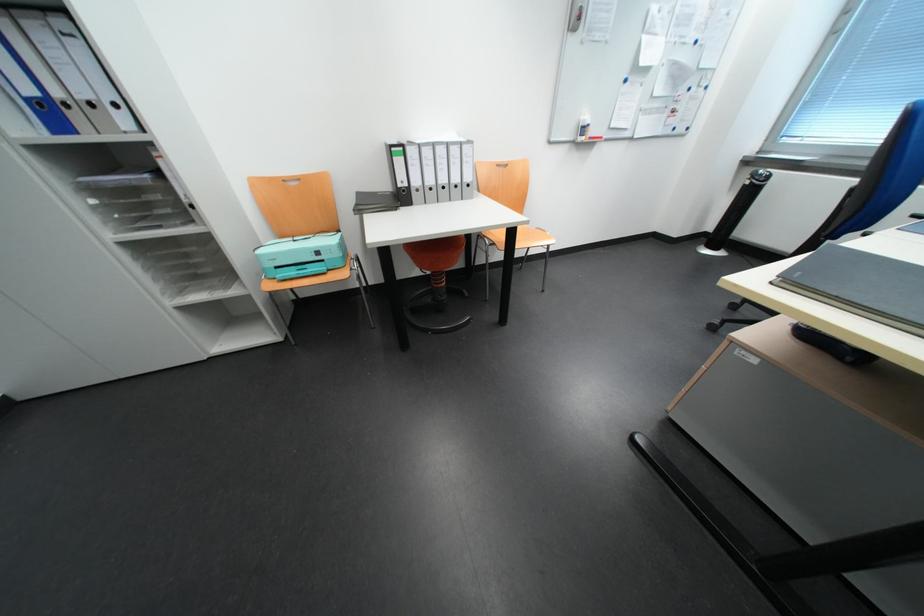
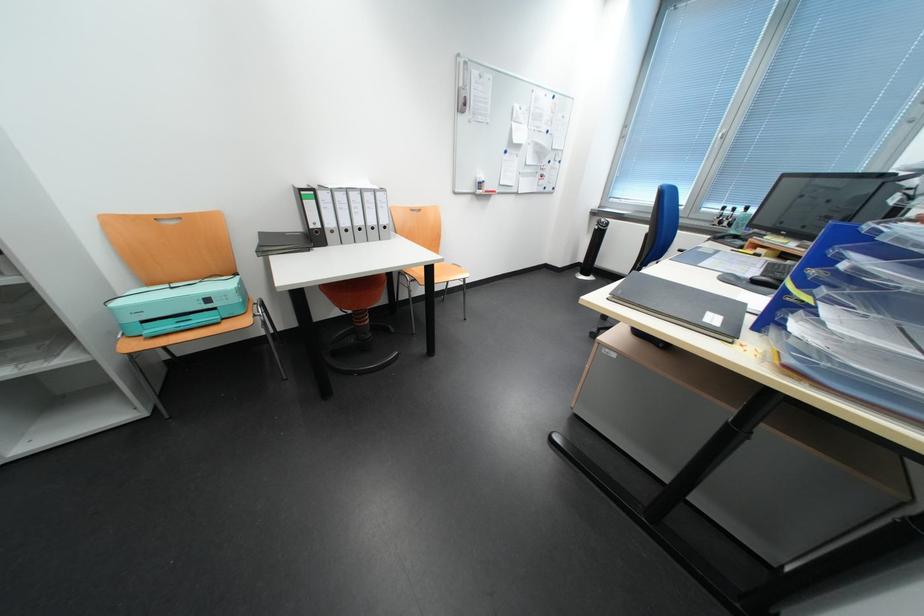
Question: What movement of the cameraman would produce the second image?

Choices:
 (A) Left
 (B) Right
 (C) Forward
 (D) Backward

Answer: (D)